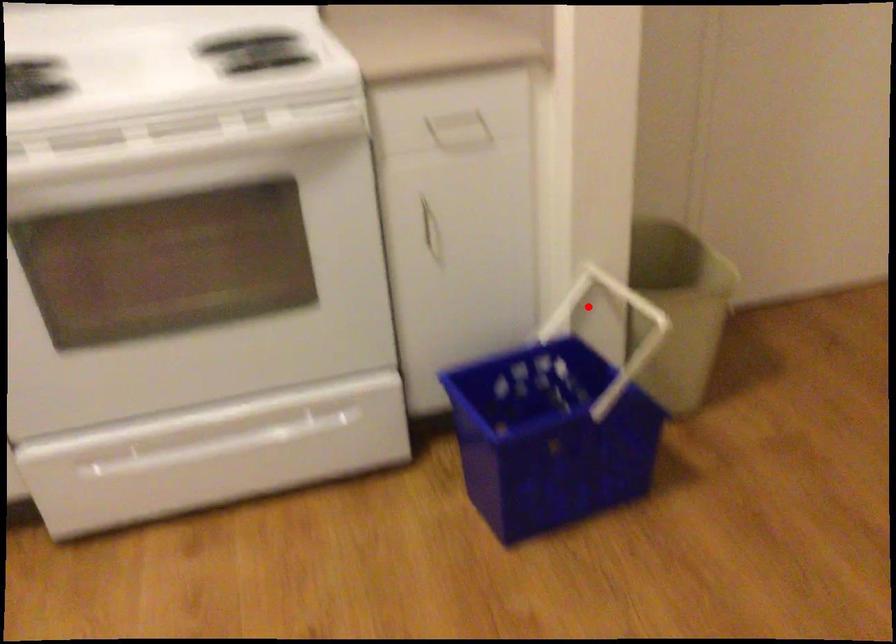
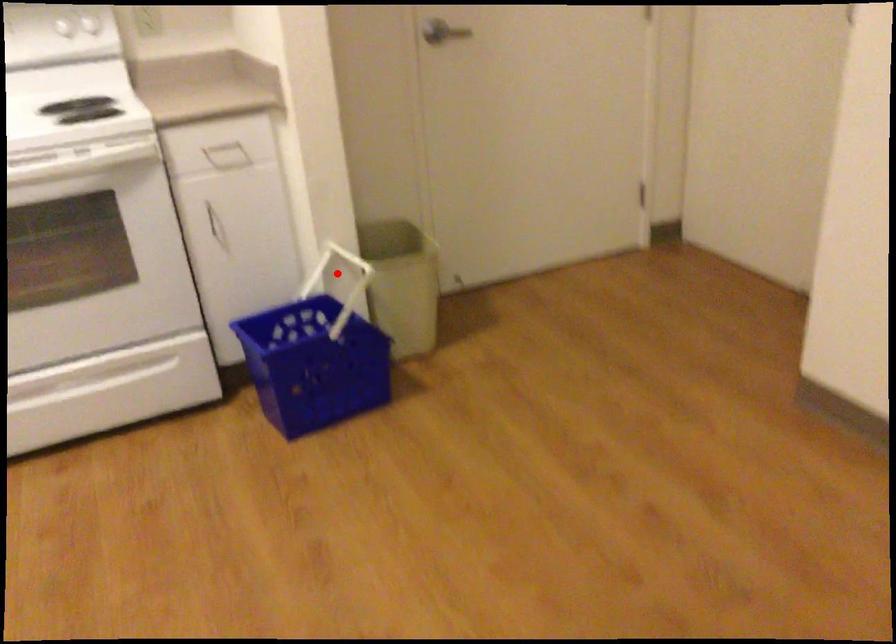
I am providing you with two images of the same scene from different viewpoints. A red point is marked on the first image and another point is marked on the second image. Do the highlighted points in image1 and image2 indicate the same real-world spot?

Yes